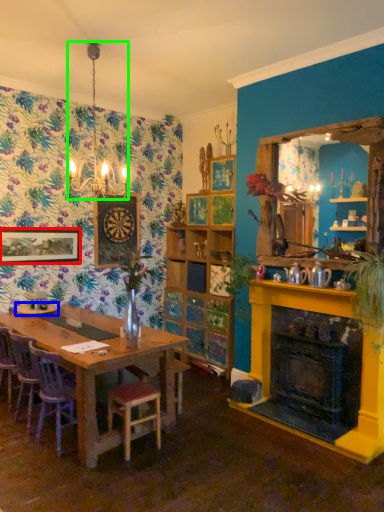
Question: Considering the real-world distances, which object is farthest from picture frame (highlighted by a red box)? tableware (highlighted by a blue box) or lamp (highlighted by a green box)?

Choices:
 (A) tableware
 (B) lamp

Answer: (B)